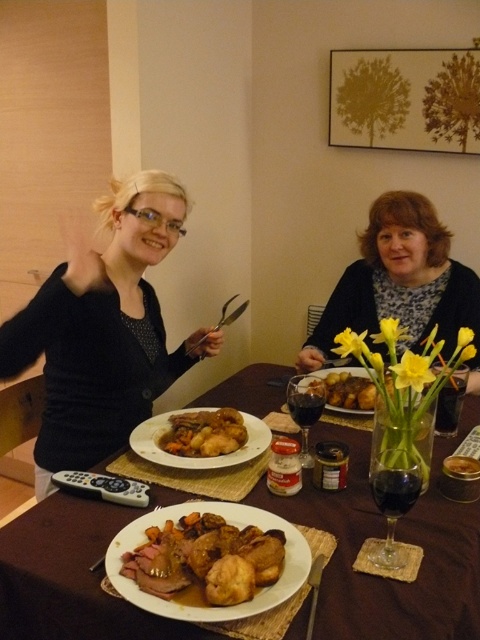
Who is shorter, matte black sweater at left or matte black sweater at center?

matte black sweater at center

Between matte black sweater at left and matte black sweater at center, which one is positioned lower?

matte black sweater at left is below.

Locate an element on the screen. Image resolution: width=480 pixels, height=640 pixels. matte black sweater at left is located at coordinates (104, 332).

What are the coordinates of `matte black sweater at left` in the screenshot? It's located at (104, 332).

Does matte black sweater at center appear on the right side of golden brown crispy roast at center?

Indeed, matte black sweater at center is positioned on the right side of golden brown crispy roast at center.

Does matte black sweater at center have a lesser height compared to golden brown crispy roast at center?

No, matte black sweater at center is not shorter than golden brown crispy roast at center.

Identify the location of matte black sweater at center. (402, 284).

You are a GUI agent. You are given a task and a screenshot of the screen. Output one action in this format:
    pyautogui.click(x=<x>, y=<y>)
    Task: Click on the matte black sweater at center
    The height and width of the screenshot is (640, 480).
    Given the screenshot: What is the action you would take?
    pyautogui.click(x=402, y=284)

Looking at this image, is brown wooden table at center to the right of brown crispy chicken at center from the viewer's perspective?

No, brown wooden table at center is not to the right of brown crispy chicken at center.

Measure the distance between point (63, 499) and camera.

Point (63, 499) is 3.78 feet away from camera.

What are the coordinates of `brown wooden table at center` in the screenshot? It's located at (398, 538).